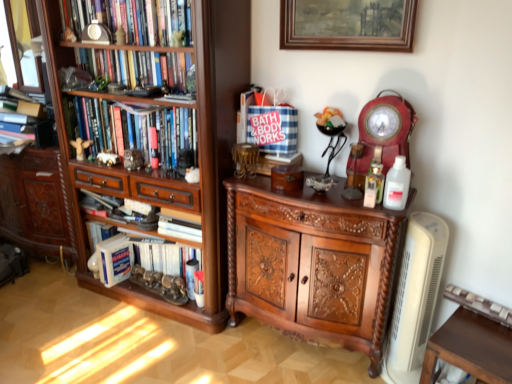
Where is `vacant location below polished wood cabinet at center (from a real-world perspective)`? Image resolution: width=512 pixels, height=384 pixels. vacant location below polished wood cabinet at center (from a real-world perspective) is located at coordinates (297, 346).